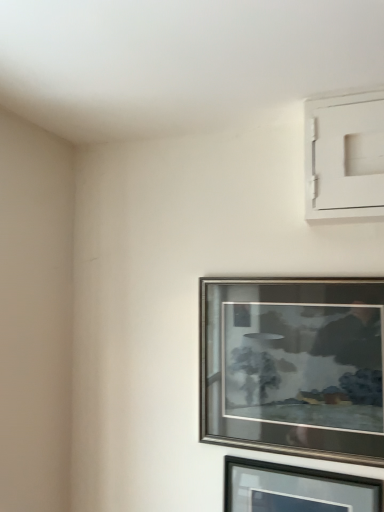
Question: Can you confirm if silver metallic picture frame at center, the 1th picture frame when ordered from top to bottom, is bigger than black glass picture frame at lower right, the second picture frame from the top?

Choices:
 (A) no
 (B) yes

Answer: (B)

Question: Is silver metallic picture frame at center, the 1th picture frame when ordered from top to bottom, closer to the viewer compared to black glass picture frame at lower right, the second picture frame from the top?

Choices:
 (A) yes
 (B) no

Answer: (B)

Question: Considering the relative positions of silver metallic picture frame at center, the 1th picture frame when ordered from top to bottom, and black glass picture frame at lower right, the second picture frame from the top, in the image provided, is silver metallic picture frame at center, the 1th picture frame when ordered from top to bottom, to the right of black glass picture frame at lower right, the second picture frame from the top, from the viewer's perspective?

Choices:
 (A) yes
 (B) no

Answer: (B)

Question: Considering the relative sizes of silver metallic picture frame at center, the 1th picture frame when ordered from top to bottom, and black glass picture frame at lower right, the second picture frame from the top, in the image provided, is silver metallic picture frame at center, the 1th picture frame when ordered from top to bottom, thinner than black glass picture frame at lower right, the second picture frame from the top,?

Choices:
 (A) yes
 (B) no

Answer: (B)

Question: Is silver metallic picture frame at center, positioned as the second picture frame in bottom-to-top order, further to camera compared to black glass picture frame at lower right, the 1th picture frame from the bottom?

Choices:
 (A) no
 (B) yes

Answer: (B)

Question: Is silver metallic picture frame at center, positioned as the second picture frame in bottom-to-top order, placed right next to black glass picture frame at lower right, the 1th picture frame from the bottom?

Choices:
 (A) yes
 (B) no

Answer: (B)

Question: Is black glass picture frame at lower right, the 1th picture frame from the bottom, oriented towards silver metallic picture frame at center, the 1th picture frame when ordered from top to bottom?

Choices:
 (A) yes
 (B) no

Answer: (B)

Question: Considering the relative positions of black glass picture frame at lower right, the second picture frame from the top, and silver metallic picture frame at center, the 1th picture frame when ordered from top to bottom, in the image provided, is black glass picture frame at lower right, the second picture frame from the top, to the right of silver metallic picture frame at center, the 1th picture frame when ordered from top to bottom, from the viewer's perspective?

Choices:
 (A) no
 (B) yes

Answer: (B)

Question: Is black glass picture frame at lower right, the second picture frame from the top, taller than silver metallic picture frame at center, the 1th picture frame when ordered from top to bottom?

Choices:
 (A) no
 (B) yes

Answer: (A)

Question: From a real-world perspective, is black glass picture frame at lower right, the second picture frame from the top, beneath silver metallic picture frame at center, positioned as the second picture frame in bottom-to-top order?

Choices:
 (A) no
 (B) yes

Answer: (B)

Question: Is black glass picture frame at lower right, the second picture frame from the top, positioned before silver metallic picture frame at center, positioned as the second picture frame in bottom-to-top order?

Choices:
 (A) no
 (B) yes

Answer: (B)

Question: Can you confirm if black glass picture frame at lower right, the second picture frame from the top, is positioned to the left of silver metallic picture frame at center, positioned as the second picture frame in bottom-to-top order?

Choices:
 (A) yes
 (B) no

Answer: (B)

Question: In terms of size, does silver metallic picture frame at center, positioned as the second picture frame in bottom-to-top order, appear bigger or smaller than black glass picture frame at lower right, the second picture frame from the top?

Choices:
 (A) small
 (B) big

Answer: (B)